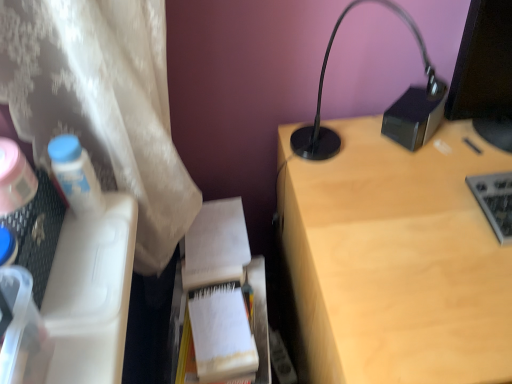
The image size is (512, 384). I want to click on blank space situated above white paper notebook at center (from a real-world perspective), so click(x=212, y=230).